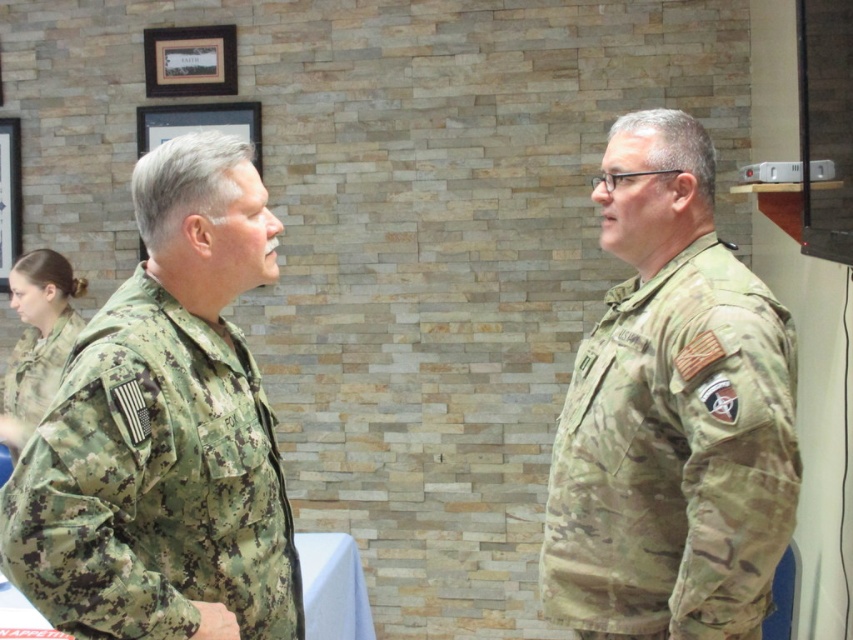
Looking at this image, between camouflage fabric uniform at left and camouflage fabric uniform at lower left, which one has less height?

camouflage fabric uniform at lower left is shorter.

Who is higher up, camouflage fabric uniform at left or camouflage fabric uniform at lower left?

camouflage fabric uniform at lower left is higher up.

Who is more forward, (157,298) or (15,369)?

Point (157,298) is in front.

What are the coordinates of `camouflage fabric uniform at left` in the screenshot? It's located at (154, 483).

Between camouflage uniform at right and white fabric table at center, which one has more height?

camouflage uniform at right

Who is positioned more to the right, camouflage uniform at right or white fabric table at center?

Positioned to the right is camouflage uniform at right.

Who is more distant from viewer, (634, 512) or (10, 620)?

Point (10, 620)

You are a GUI agent. You are given a task and a screenshot of the screen. Output one action in this format:
    pyautogui.click(x=<x>, y=<y>)
    Task: Click on the camouflage uniform at right
    The width and height of the screenshot is (853, 640).
    Given the screenshot: What is the action you would take?
    pyautogui.click(x=671, y=413)

Does camouflage uniform at right have a larger size compared to camouflage fabric uniform at left?

Correct, camouflage uniform at right is larger in size than camouflage fabric uniform at left.

Which is more to the right, camouflage uniform at right or camouflage fabric uniform at left?

Positioned to the right is camouflage uniform at right.

Which is in front, point (553, 483) or point (86, 572)?

Positioned in front is point (86, 572).

Image resolution: width=853 pixels, height=640 pixels. I want to click on camouflage uniform at right, so click(x=671, y=413).